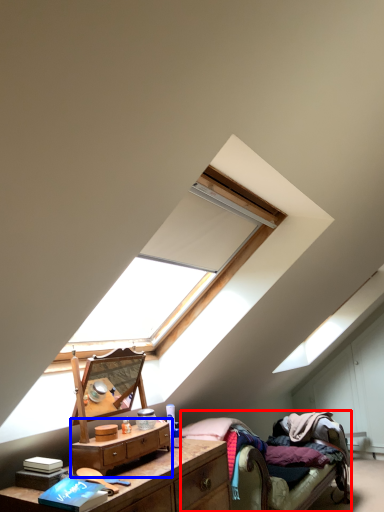
Question: Which point is further to the camera, bed (highlighted by a red box) or nightstand (highlighted by a blue box)?

Choices:
 (A) bed
 (B) nightstand

Answer: (A)